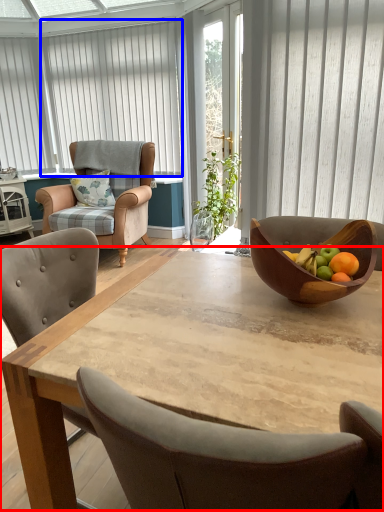
Question: Which object is further to the camera taking this photo, coffee table (highlighted by a red box) or curtain (highlighted by a blue box)?

Choices:
 (A) coffee table
 (B) curtain

Answer: (B)